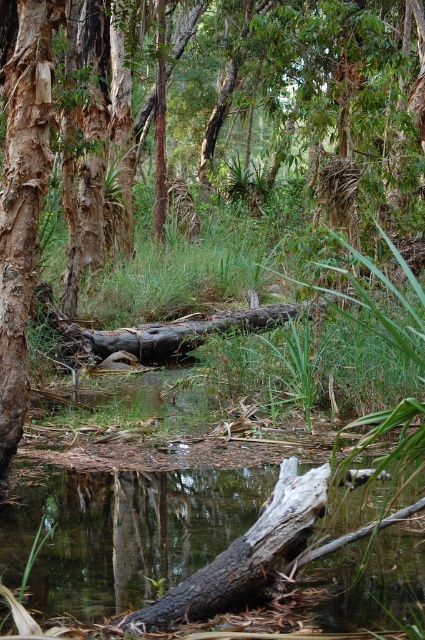
Based on the photo, you are standing in the forest scene and want to place a small flag at each of the two points marked in the image. Which point, point (73,582) or point (31,268), should you reach first if you move directly toward them from your current position?

You should reach point (73,582) first because it is closer to you than point (31,268).